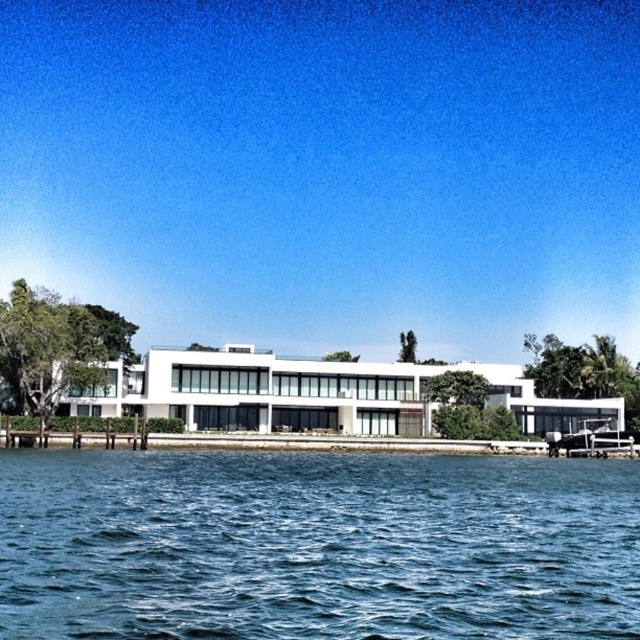
Which of these two, blue water at lower center or metallic silver boat at right, stands taller?

Standing taller between the two is blue water at lower center.

What do you see at coordinates (316, 545) in the screenshot? I see `blue water at lower center` at bounding box center [316, 545].

You are a GUI agent. You are given a task and a screenshot of the screen. Output one action in this format:
    pyautogui.click(x=<x>, y=<y>)
    Task: Click on the blue water at lower center
    The image size is (640, 640).
    Given the screenshot: What is the action you would take?
    click(x=316, y=545)